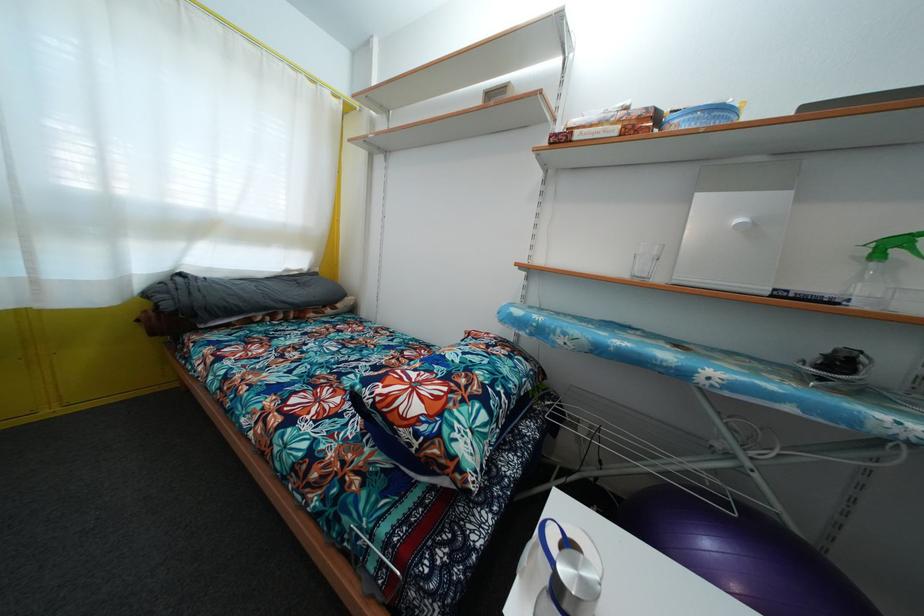
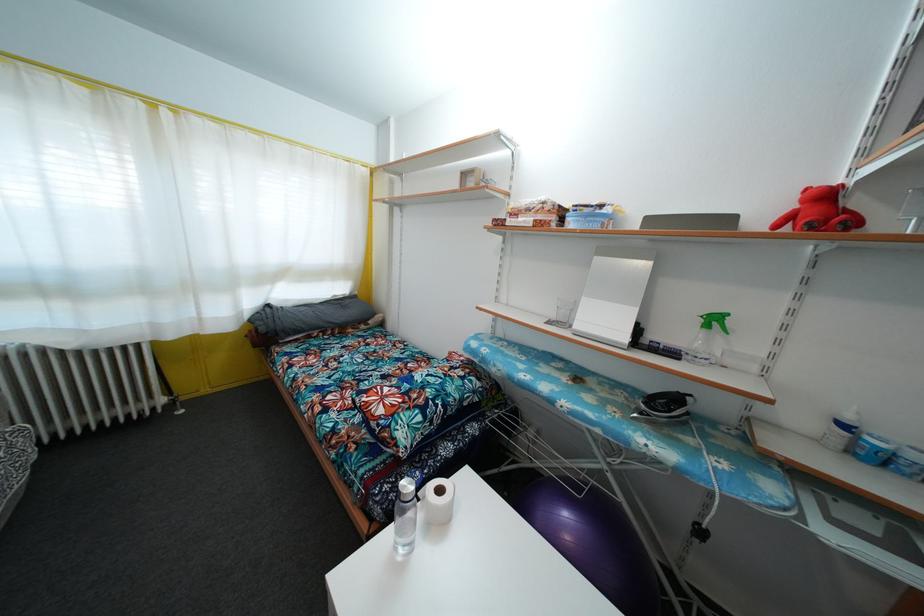
Locate, in the second image, the point that corresponds to pixel 321 276 in the first image.

(359, 300)